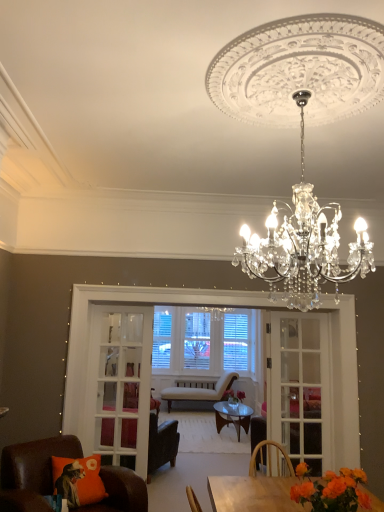
Question: Is pink matte vase at center, acting as the 2th flower starting from the front, surrounded by leather armchair at center, the 2th chair in the back-to-front sequence?

Choices:
 (A) no
 (B) yes

Answer: (A)

Question: From the image's perspective, is leather armchair at center, the second chair from the front, on pink matte vase at center, arranged as the 2th flower when viewed from the top?

Choices:
 (A) yes
 (B) no

Answer: (A)

Question: Is leather armchair at center, the 2th chair in the back-to-front sequence, oriented away from pink matte vase at center, acting as the 2th flower starting from the front?

Choices:
 (A) yes
 (B) no

Answer: (B)

Question: Does leather armchair at center, the 2th chair in the back-to-front sequence, appear on the left side of pink matte vase at center, arranged as the 2th flower when viewed from the top?

Choices:
 (A) no
 (B) yes

Answer: (B)

Question: Does leather armchair at center, the second chair from the front, appear on the right side of pink matte vase at center, arranged as the first flower when ordered from the bottom?

Choices:
 (A) no
 (B) yes

Answer: (A)

Question: Is white glass screen door at center, positioned as the first screen door in left-to-right order, in front of or behind light beige fabric chair at center, arranged as the first chair when viewed from the back, in the image?

Choices:
 (A) behind
 (B) front

Answer: (B)

Question: From their relative heights in the image, would you say white glass screen door at center, positioned as the first screen door in left-to-right order, is taller or shorter than light beige fabric chair at center, the third chair in the front-to-back sequence?

Choices:
 (A) tall
 (B) short

Answer: (A)

Question: Which is correct: white glass screen door at center, positioned as the first screen door in left-to-right order, is inside light beige fabric chair at center, arranged as the first chair when viewed from the back, or outside of it?

Choices:
 (A) outside
 (B) inside

Answer: (A)

Question: From a real-world perspective, is white glass screen door at center, which is the second screen door in right-to-left order, physically located above or below light beige fabric chair at center, the third chair in the front-to-back sequence?

Choices:
 (A) below
 (B) above

Answer: (B)

Question: From the image's perspective, is leather armchair at center, the 2th chair in the back-to-front sequence, positioned above or below pink matte vase at center, arranged as the 2th flower when viewed from the top?

Choices:
 (A) above
 (B) below

Answer: (A)

Question: In terms of size, does leather armchair at center, the second chair from the front, appear bigger or smaller than pink matte vase at center, arranged as the 2th flower when viewed from the top?

Choices:
 (A) small
 (B) big

Answer: (B)

Question: From a real-world perspective, is leather armchair at center, the 2th chair in the back-to-front sequence, positioned above or below pink matte vase at center, which is counted as the 1th flower, starting from the back?

Choices:
 (A) above
 (B) below

Answer: (B)

Question: In the image, is leather armchair at center, the second chair from the front, on the left side or the right side of pink matte vase at center, arranged as the first flower when ordered from the bottom?

Choices:
 (A) right
 (B) left

Answer: (B)

Question: Visually, is brown leather chair at lower left, arranged as the 3th chair when viewed from the back, positioned to the left or to the right of clear crystal chandelier at upper center?

Choices:
 (A) left
 (B) right

Answer: (A)

Question: Do you think brown leather chair at lower left, placed as the first chair when sorted from front to back, is within clear crystal chandelier at upper center, or outside of it?

Choices:
 (A) inside
 (B) outside

Answer: (B)